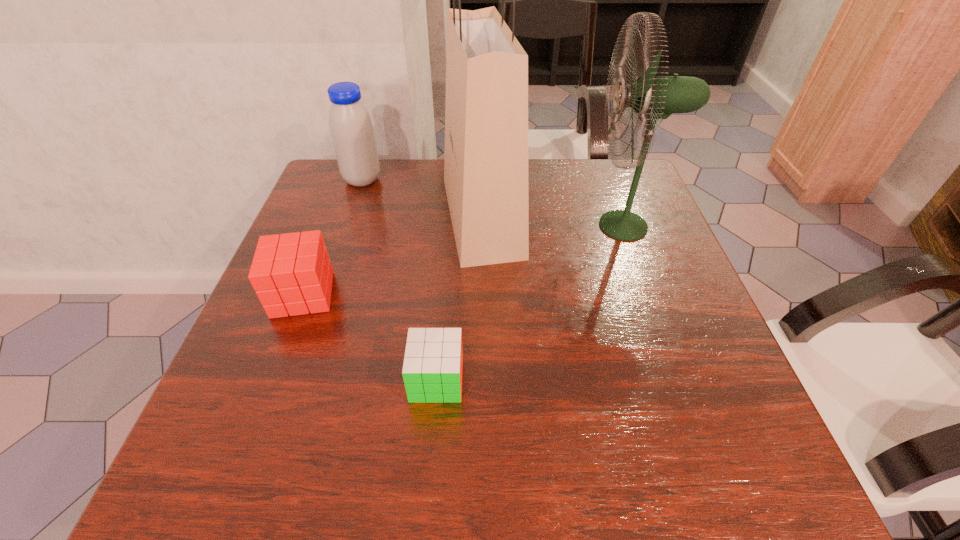
The image size is (960, 540). In order to click on shopping bag in this screenshot , I will do `click(486, 110)`.

Image resolution: width=960 pixels, height=540 pixels. In order to click on the rightmost object in this screenshot , I will do `click(652, 97)`.

Find the location of a particular element. the third shortest object is located at coordinates (351, 129).

Find the location of `the left cube`. the left cube is located at coordinates (291, 273).

Identify the location of the fourth farthest object. (291, 273).

Find the location of a particular element. This screenshot has height=540, width=960. the shorter cube is located at coordinates (432, 369).

At what (x,y) coordinates should I click in order to perform the action: click on the nearer cube. Please return your answer as a coordinate pair (x, y). This screenshot has width=960, height=540. Looking at the image, I should click on (432, 369).

You are a GUI agent. You are given a task and a screenshot of the screen. Output one action in this format:
    pyautogui.click(x=<x>, y=<y>)
    Task: Click on the free region located 0.320m on the left of the shopping bag
    
    Given the screenshot: What is the action you would take?
    pyautogui.click(x=308, y=217)

Where is `vacant space located on the front-facing side of the fan`? vacant space located on the front-facing side of the fan is located at coordinates (462, 226).

You are a GUI agent. You are given a task and a screenshot of the screen. Output one action in this format:
    pyautogui.click(x=<x>, y=<y>)
    Task: Click on the vacant space located 0.400m on the front-facing side of the fan
    Image resolution: width=960 pixels, height=540 pixels.
    Given the screenshot: What is the action you would take?
    pyautogui.click(x=420, y=226)